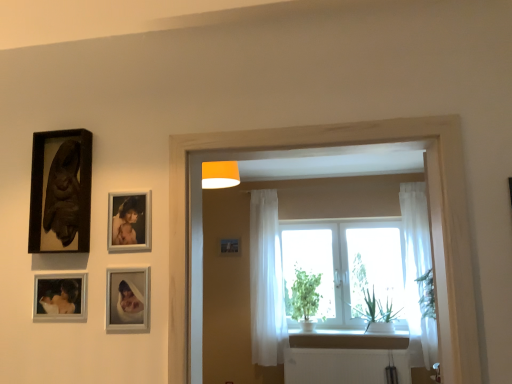
Find the location of a particular element. The image size is (512, 384). free location above white plastic radiator at lower center (from a real-world perspective) is located at coordinates (347, 345).